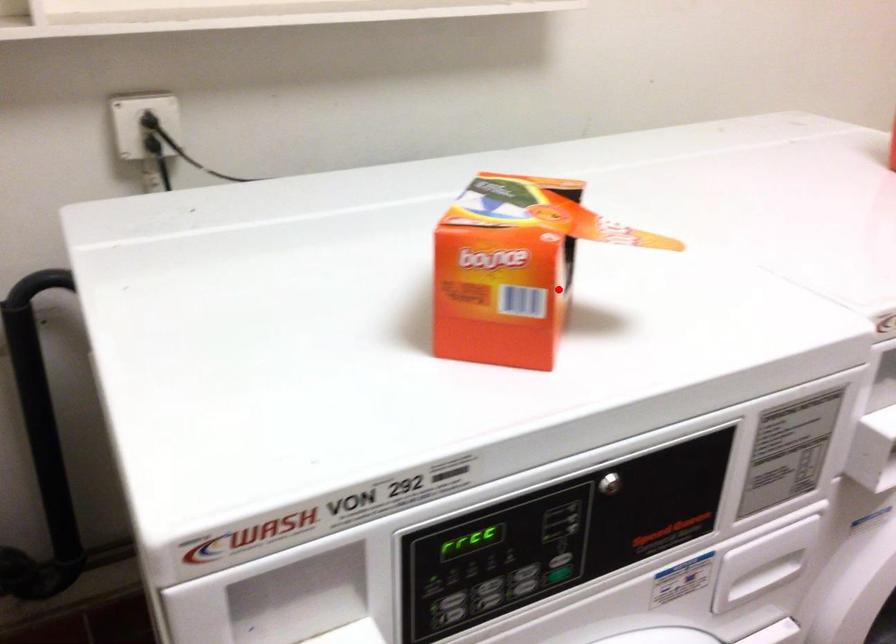
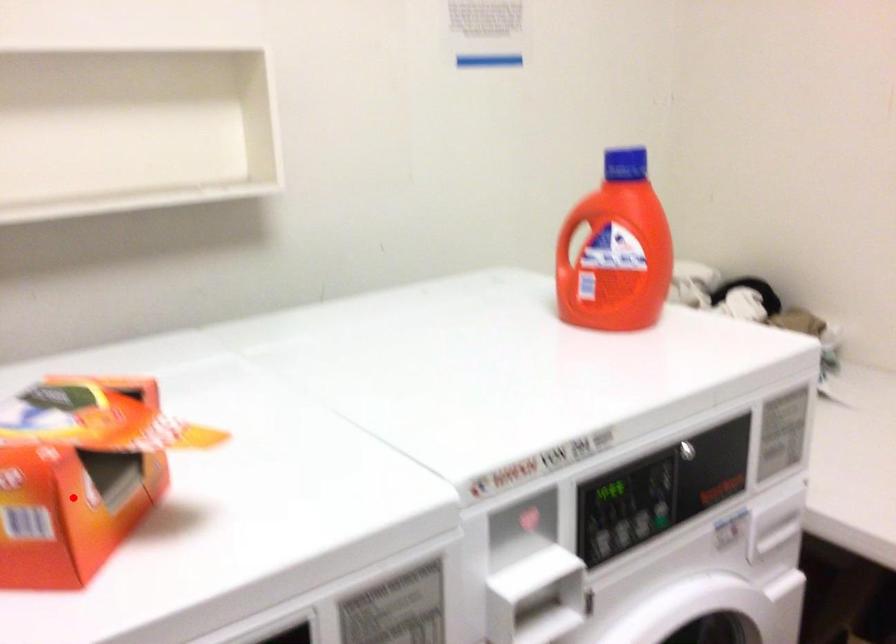
I am providing you with two images of the same scene from different viewpoints. A red point is marked on the first image and another point is marked on the second image. Does the point marked in image1 correspond to the same location as the one in image2?

Yes